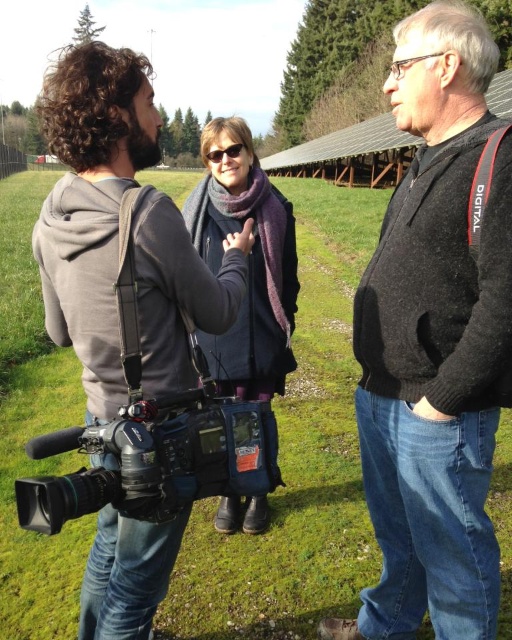
Question: Is gray matte hoodie at left positioned in front of black matte camera at lower left?

Choices:
 (A) yes
 (B) no

Answer: (B)

Question: Which point is farther to the camera?

Choices:
 (A) (228, 150)
 (B) (215, 262)
 (C) (444, 442)
 (D) (68, 435)

Answer: (A)

Question: Which of the following is the farthest from the observer?

Choices:
 (A) (458, 449)
 (B) (200, 241)
 (C) (232, 150)
 (D) (212, 417)

Answer: (B)

Question: Estimate the real-world distances between objects in this image. Which object is closer to the purple wool scarf at center?

Choices:
 (A) black matte camera at lower left
 (B) black wool sweater at right
 (C) gray matte hoodie at left
 (D) matte black sunglasses at center

Answer: (C)

Question: Is black matte camera at lower left behind purple wool scarf at center?

Choices:
 (A) no
 (B) yes

Answer: (A)

Question: Is gray matte hoodie at left closer to the viewer compared to matte black sunglasses at center?

Choices:
 (A) yes
 (B) no

Answer: (A)